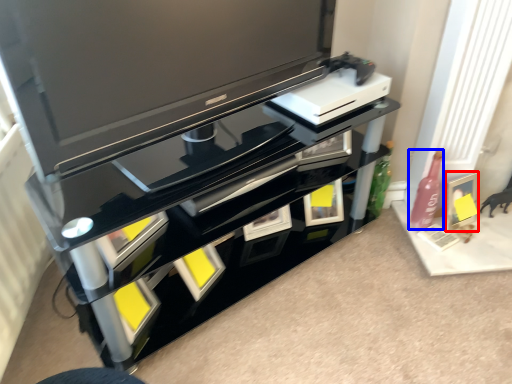
Question: Which of the following is the closest to the observer, picture frame (highlighted by a red box) or bottle (highlighted by a blue box)?

Choices:
 (A) picture frame
 (B) bottle

Answer: (B)